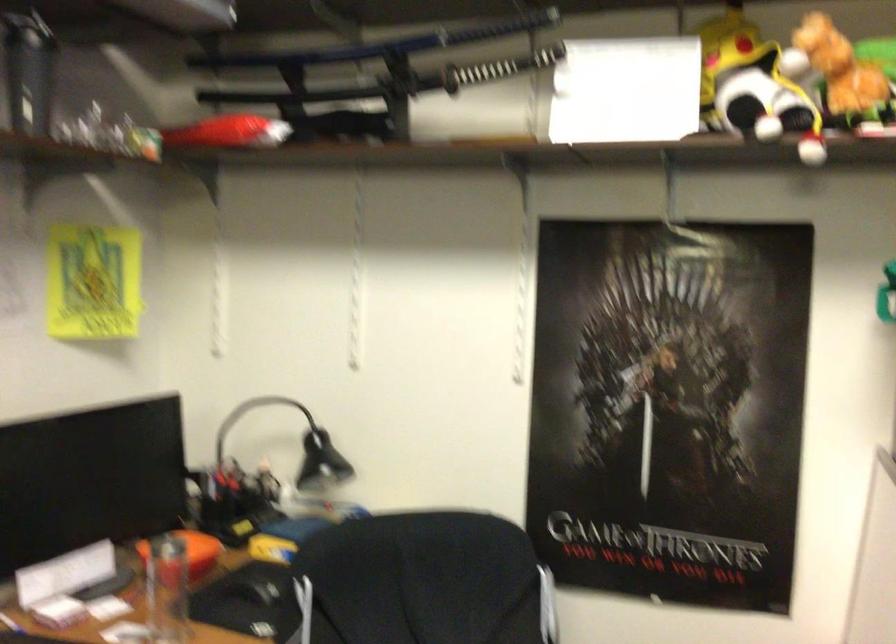
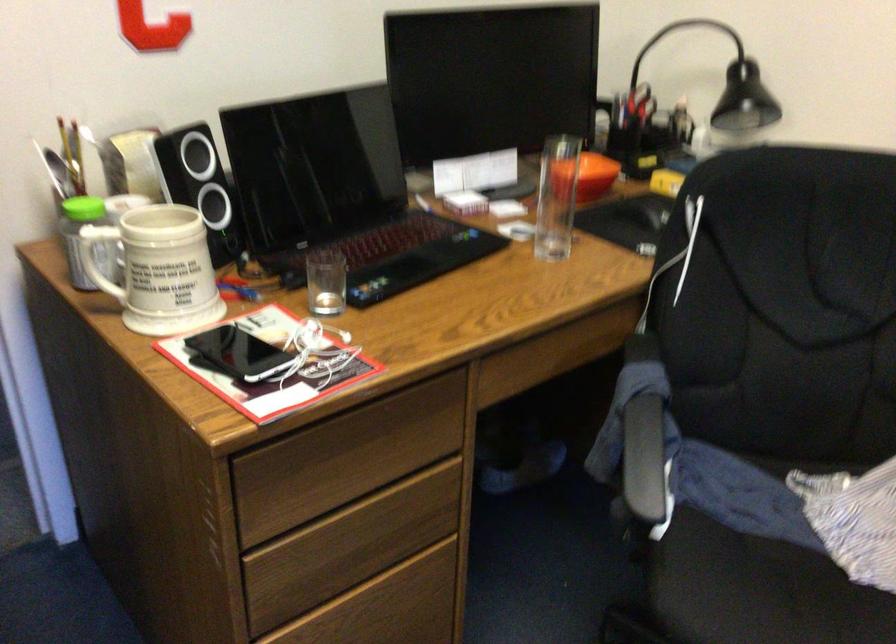
Locate, in the second image, the point that corresponds to (x=196, y=562) in the first image.

(590, 176)